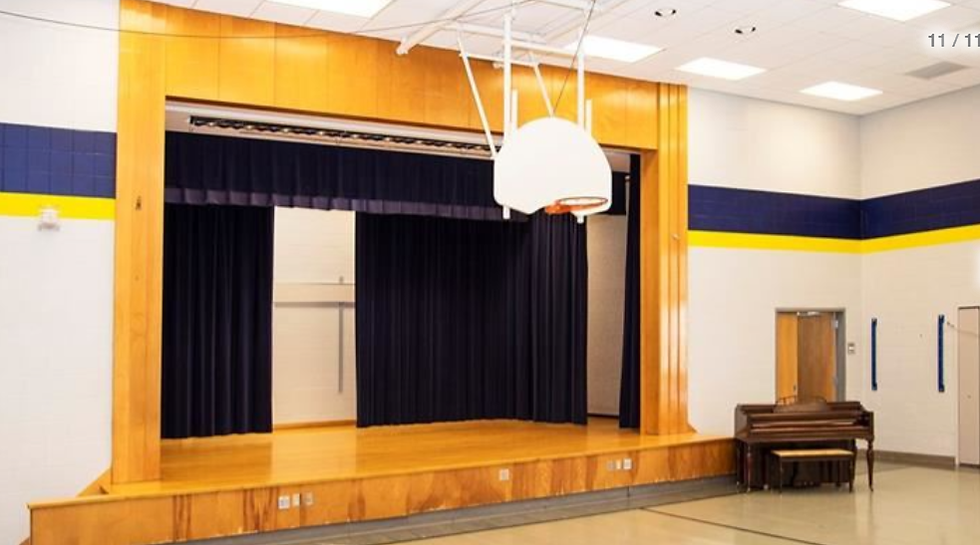
Identify the location of floor. point(828,512).